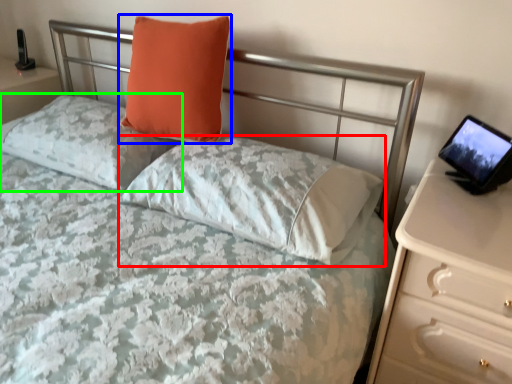
Question: Considering the real-world distances, which object is farthest from pillow (highlighted by a red box)? pillow (highlighted by a blue box) or pillow (highlighted by a green box)?

Choices:
 (A) pillow
 (B) pillow

Answer: (B)